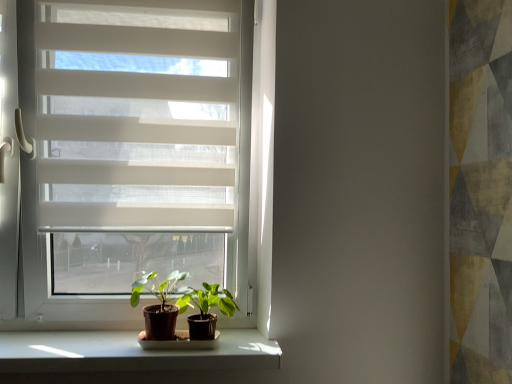
Image resolution: width=512 pixels, height=384 pixels. Find the location of `free spot below white matte window at center (from a real-world perspective)`. free spot below white matte window at center (from a real-world perspective) is located at coordinates (75, 336).